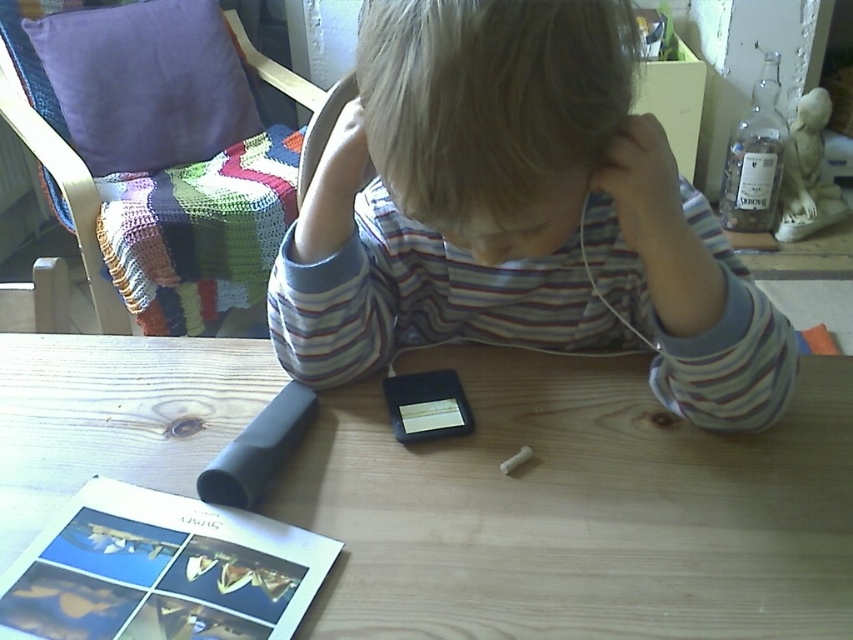
Question: Does wooden table at center come in front of blonde hair at center?

Choices:
 (A) no
 (B) yes

Answer: (A)

Question: Which point is farther to the camera?

Choices:
 (A) wooden table at center
 (B) blonde hair at center
 (C) striped cotton shirt at center

Answer: (A)

Question: Does wooden table at center have a greater width compared to striped cotton shirt at center?

Choices:
 (A) yes
 (B) no

Answer: (A)

Question: Among these objects, which one is farthest from the camera?

Choices:
 (A) striped cotton shirt at center
 (B) blonde hair at center
 (C) wooden table at center

Answer: (C)

Question: Is striped cotton shirt at center to the right of blonde hair at center from the viewer's perspective?

Choices:
 (A) no
 (B) yes

Answer: (B)

Question: Estimate the real-world distances between objects in this image. Which object is closer to the blonde hair at center?

Choices:
 (A) wooden table at center
 (B) striped cotton shirt at center

Answer: (B)